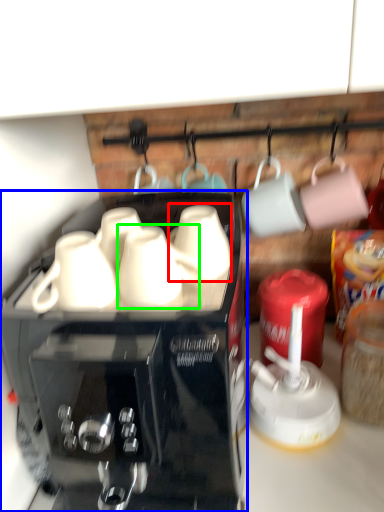
Question: Estimate the real-world distances between objects in this image. Which object is closer to mug (highlighted by a red box), coffee maker (highlighted by a blue box) or mug (highlighted by a green box)?

Choices:
 (A) coffee maker
 (B) mug

Answer: (B)